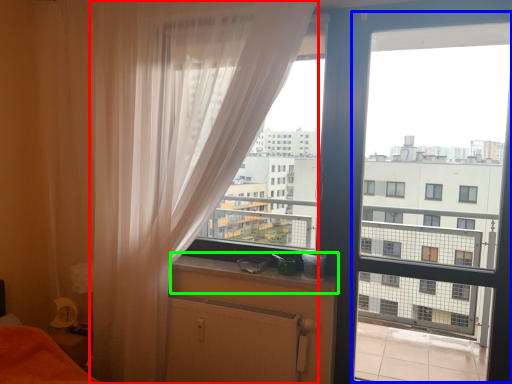
Question: Estimate the real-world distances between objects in this image. Which object is farther from curtain (highlighted by a red box), screen door (highlighted by a blue box) or window sill (highlighted by a green box)?

Choices:
 (A) screen door
 (B) window sill

Answer: (A)